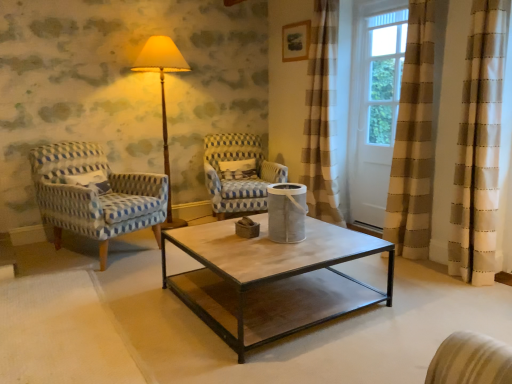
What do you see at coordinates (163, 96) in the screenshot? I see `matte yellow fabric at center` at bounding box center [163, 96].

Measure the distance between white textured pillow at center and camera.

white textured pillow at center is 3.91 meters away from camera.

Identify the location of blue and white woven fabric armchair at center, which is the second chair in left-to-right order. (237, 173).

At what (x,y) coordinates should I click in order to perform the action: click on white wood screen door at upper right. Please return your answer as a coordinate pair (x, y). The width and height of the screenshot is (512, 384). Looking at the image, I should click on (375, 106).

Can you see matte yellow fabric at center touching white textured pillow at center?

There is a gap between matte yellow fabric at center and white textured pillow at center.

From a real-world perspective, which is physically above, matte yellow fabric at center or white textured pillow at center?

matte yellow fabric at center.

Based on their positions, is matte yellow fabric at center located to the left or right of white textured pillow at center?

From the image, it's evident that matte yellow fabric at center is to the left of white textured pillow at center.

Is white textured pillow at center at the back of matte yellow fabric at center?

No, matte yellow fabric at center is not facing away from white textured pillow at center.

Looking at this image, is white textured pillow at center directly adjacent to white wood screen door at upper right?

white textured pillow at center and white wood screen door at upper right are not in contact.

From a real-world perspective, is white textured pillow at center below white wood screen door at upper right?

Correct, in the physical world, white textured pillow at center is lower than white wood screen door at upper right.

Is point (232, 167) closer or farther from the camera than point (358, 148)?

Point (232, 167) appears to be farther away from the viewer than point (358, 148).

Between white textured pillow at center and white wood screen door at upper right, which one has smaller size?

With smaller size is white textured pillow at center.

Considering the sizes of white wood screen door at upper right and blue and white woven fabric armchair at center, which is the second chair in left-to-right order, in the image, is white wood screen door at upper right taller or shorter than blue and white woven fabric armchair at center, which is the second chair in left-to-right order,?

Clearly, white wood screen door at upper right is taller compared to blue and white woven fabric armchair at center, which is the second chair in left-to-right order.

From a real-world perspective, is white wood screen door at upper right positioned under blue and white woven fabric armchair at center, which is the second chair in left-to-right order, based on gravity?

No.

Find the location of a particular element. the 1st chair counting from the left side of the white wood screen door at upper right is located at coordinates (237, 173).

Is white wood screen door at upper right spatially inside blue and white woven fabric armchair at center, which is the second chair in left-to-right order, or outside of it?

white wood screen door at upper right is spatially situated outside blue and white woven fabric armchair at center, which is the second chair in left-to-right order.

Who is bigger, blue-patterned fabric armchair at left, which is the 2th chair from right to left, or white textured pillow at center?

blue-patterned fabric armchair at left, which is the 2th chair from right to left.

Is point (82, 155) closer or farther from the camera than point (254, 159)?

Point (82, 155) is positioned closer to the camera compared to point (254, 159).

Is blue-patterned fabric armchair at left, which is the 1th chair from left to right, positioned far away from white textured pillow at center?

Yes, blue-patterned fabric armchair at left, which is the 1th chair from left to right, and white textured pillow at center are quite far apart.

From the image's perspective, is blue-patterned fabric armchair at left, which is the 1th chair from left to right, located above or below white textured pillow at center?

blue-patterned fabric armchair at left, which is the 1th chair from left to right, is below white textured pillow at center.

Considering the positions of objects blue and white woven fabric armchair at center, which appears as the 1th chair when viewed from the right, and white wood screen door at upper right in the image provided, who is in front, blue and white woven fabric armchair at center, which appears as the 1th chair when viewed from the right, or white wood screen door at upper right?

white wood screen door at upper right is more forward.

Who is taller, blue and white woven fabric armchair at center, which is the second chair in left-to-right order, or white wood screen door at upper right?

white wood screen door at upper right.

Which object is positioned more to the left, matte yellow fabric at center or white wood screen door at upper right?

Positioned to the left is matte yellow fabric at center.

In the image, is matte yellow fabric at center positioned in front of or behind white wood screen door at upper right?

Clearly, matte yellow fabric at center is behind white wood screen door at upper right.

Locate an element on the screen. The height and width of the screenshot is (384, 512). table lamp lying below the white wood screen door at upper right (from the image's perspective) is located at coordinates (163, 96).

Is matte yellow fabric at center positioned with its back to white wood screen door at upper right?

That's not correct — matte yellow fabric at center is not looking away from white wood screen door at upper right.

In terms of height, does white wood screen door at upper right look taller or shorter compared to blue-patterned fabric armchair at left, which is the 2th chair from right to left?

Clearly, white wood screen door at upper right is taller compared to blue-patterned fabric armchair at left, which is the 2th chair from right to left.

Does white wood screen door at upper right touch blue-patterned fabric armchair at left, which is the 1th chair from left to right?

No, white wood screen door at upper right is not making contact with blue-patterned fabric armchair at left, which is the 1th chair from left to right.

How many degrees apart are the facing directions of white wood screen door at upper right and blue-patterned fabric armchair at left, which is the 1th chair from left to right?

white wood screen door at upper right and blue-patterned fabric armchair at left, which is the 1th chair from left to right, are facing 110 degrees away from each other.

In order to click on table lamp above the white textured pillow at center (from the image's perspective) in this screenshot , I will do `click(163, 96)`.

You are a GUI agent. You are given a task and a screenshot of the screen. Output one action in this format:
    pyautogui.click(x=<x>, y=<y>)
    Task: Click on the pillow on the left of the white wood screen door at upper right
    
    Given the screenshot: What is the action you would take?
    pyautogui.click(x=238, y=169)

Looking at this image, which object lies further to the anchor point matte yellow fabric at center, white textured pillow at center or blue and white woven fabric armchair at center, which appears as the 1th chair when viewed from the right?

The object further to matte yellow fabric at center is blue and white woven fabric armchair at center, which appears as the 1th chair when viewed from the right.

Looking at the image, which one is located further to blue-patterned fabric armchair at left, which is the 2th chair from right to left, white wood screen door at upper right or matte yellow fabric at center?

white wood screen door at upper right.

Considering their positions, is white textured pillow at center positioned closer to matte yellow fabric at center than white wood screen door at upper right?

Based on the image, white textured pillow at center appears to be nearer to matte yellow fabric at center.

When comparing their distances from white textured pillow at center, does matte yellow fabric at center or blue and white woven fabric armchair at center, which is the second chair in left-to-right order, seem closer?

blue and white woven fabric armchair at center, which is the second chair in left-to-right order, is positioned closer to the anchor white textured pillow at center.

When comparing their distances from blue-patterned fabric armchair at left, which is the 2th chair from right to left, does matte yellow fabric at center or white textured pillow at center seem closer?

matte yellow fabric at center is closer to blue-patterned fabric armchair at left, which is the 2th chair from right to left.

When comparing their distances from white textured pillow at center, does white wood screen door at upper right or matte yellow fabric at center seem further?

white wood screen door at upper right.

Which object lies nearer to the anchor point white wood screen door at upper right, blue-patterned fabric armchair at left, which is the 1th chair from left to right, or blue and white woven fabric armchair at center, which is the second chair in left-to-right order?

The object closer to white wood screen door at upper right is blue and white woven fabric armchair at center, which is the second chair in left-to-right order.

Considering their positions, is white wood screen door at upper right positioned closer to blue and white woven fabric armchair at center, which is the second chair in left-to-right order, than blue-patterned fabric armchair at left, which is the 1th chair from left to right?

The object closer to blue and white woven fabric armchair at center, which is the second chair in left-to-right order, is blue-patterned fabric armchair at left, which is the 1th chair from left to right.

Find the location of a particular element. The height and width of the screenshot is (384, 512). pillow between blue-patterned fabric armchair at left, which is the 2th chair from right to left, and white wood screen door at upper right is located at coordinates (238, 169).

This screenshot has width=512, height=384. I want to click on pillow between matte yellow fabric at center and white wood screen door at upper right, so [238, 169].

Find the location of a particular element. Image resolution: width=512 pixels, height=384 pixels. table lamp located between blue-patterned fabric armchair at left, which is the 2th chair from right to left, and white textured pillow at center in the depth direction is located at coordinates (163, 96).

You are a GUI agent. You are given a task and a screenshot of the screen. Output one action in this format:
    pyautogui.click(x=<x>, y=<y>)
    Task: Click on the chair situated between blue-patterned fabric armchair at left, which is the 1th chair from left to right, and white wood screen door at upper right from left to right
    
    Given the screenshot: What is the action you would take?
    click(x=237, y=173)